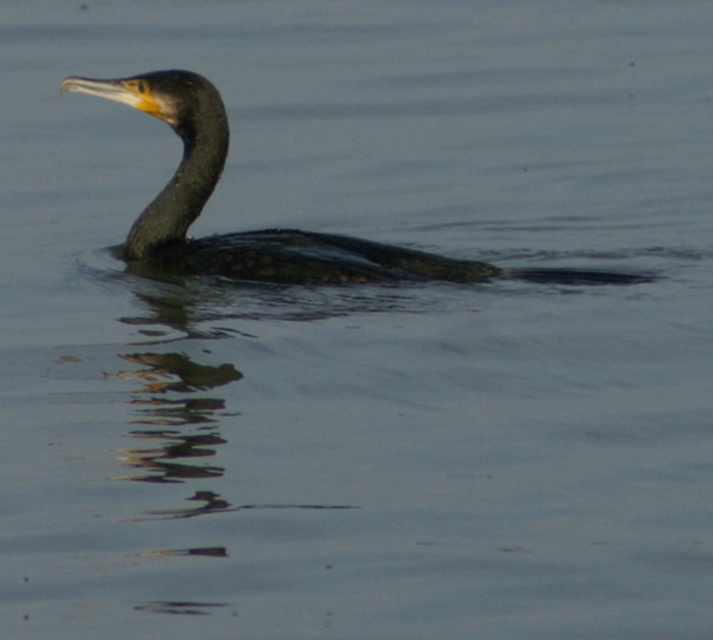
Is shiny black duck at center further to the viewer compared to dark gray matte neck at center?

No, it is in front of dark gray matte neck at center.

Is point (338, 266) farther from viewer compared to point (148, 212)?

No, it is in front of (148, 212).

Between point (414, 269) and point (179, 209), which one is positioned behind?

Point (179, 209)

I want to click on shiny black duck at center, so click(266, 228).